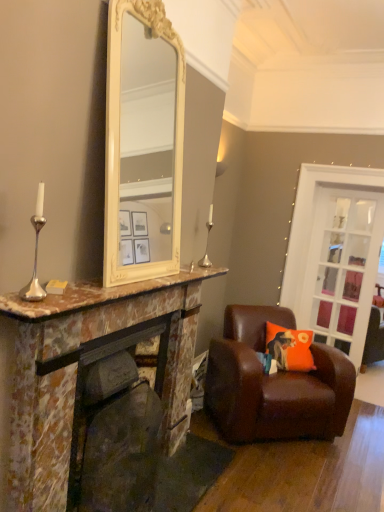
Question: From the image's perspective, is marble fireplace at left located beneath brown leather chair at lower right?

Choices:
 (A) no
 (B) yes

Answer: (A)

Question: From a real-world perspective, is marble fireplace at left located beneath brown leather chair at lower right?

Choices:
 (A) yes
 (B) no

Answer: (B)

Question: Is marble fireplace at left in front of brown leather chair at lower right?

Choices:
 (A) no
 (B) yes

Answer: (B)

Question: Is the surface of marble fireplace at left in direct contact with brown leather chair at lower right?

Choices:
 (A) no
 (B) yes

Answer: (A)

Question: Is marble fireplace at left looking in the opposite direction of brown leather chair at lower right?

Choices:
 (A) no
 (B) yes

Answer: (A)

Question: From the image's perspective, is silver/metallic candle holder at center above or below marble fireplace at left?

Choices:
 (A) above
 (B) below

Answer: (A)

Question: Would you say silver/metallic candle holder at center is inside or outside marble fireplace at left?

Choices:
 (A) inside
 (B) outside

Answer: (B)

Question: Considering their positions, is silver/metallic candle holder at center located in front of or behind marble fireplace at left?

Choices:
 (A) front
 (B) behind

Answer: (B)

Question: Does point (211, 204) appear closer or farther from the camera than point (57, 444)?

Choices:
 (A) closer
 (B) farther

Answer: (B)

Question: Would you say orange fabric cushion at right is inside or outside clear glass door at right?

Choices:
 (A) inside
 (B) outside

Answer: (B)

Question: In terms of width, does orange fabric cushion at right look wider or thinner when compared to clear glass door at right?

Choices:
 (A) wide
 (B) thin

Answer: (A)

Question: From a real-world perspective, is orange fabric cushion at right physically located above or below clear glass door at right?

Choices:
 (A) below
 (B) above

Answer: (A)

Question: Considering their positions, is orange fabric cushion at right located in front of or behind clear glass door at right?

Choices:
 (A) behind
 (B) front

Answer: (B)

Question: Which is correct: silver/metallic candle holder at center is inside marble fireplace at center, or outside of it?

Choices:
 (A) inside
 (B) outside

Answer: (B)

Question: Considering the relative positions of silver/metallic candle holder at center and marble fireplace at center in the image provided, is silver/metallic candle holder at center to the left or to the right of marble fireplace at center?

Choices:
 (A) right
 (B) left

Answer: (A)